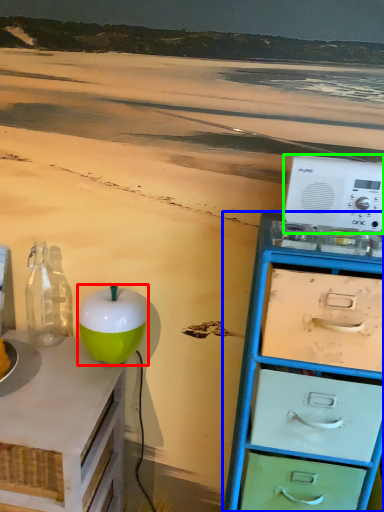
Question: Considering the real-world distances, which object is closest to teal (highlighted by a red box)? chest of drawers (highlighted by a blue box) or appliance (highlighted by a green box).

Choices:
 (A) chest of drawers
 (B) appliance

Answer: (A)